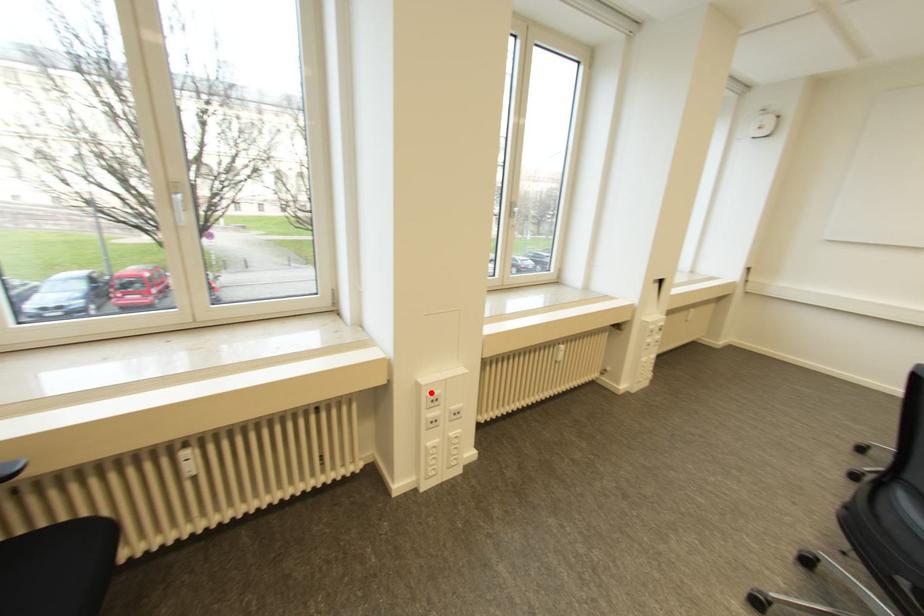
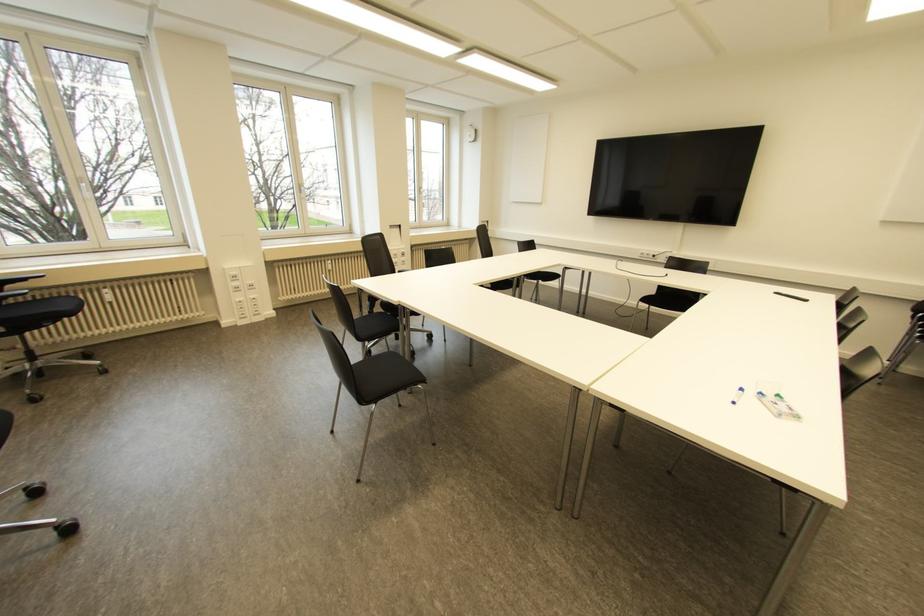
Question: I am providing you with two images of the same scene from different viewpoints. In image1, a red point is highlighted. Considering the same 3D point in image2, which of the following is correct?

Choices:
 (A) It is closer
 (B) It is farther

Answer: (A)